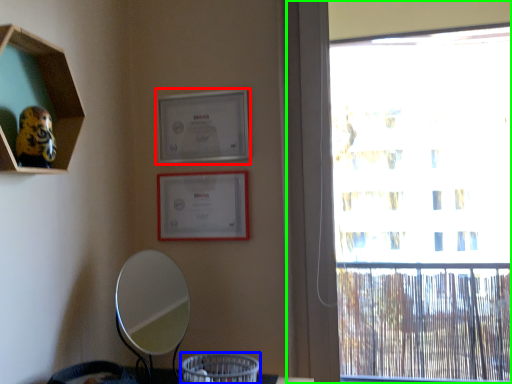
Question: Based on their relative distances, which object is nearer to picture frame (highlighted by a red box)? Choose from basket (highlighted by a blue box) and window (highlighted by a green box).

Choices:
 (A) basket
 (B) window

Answer: (A)